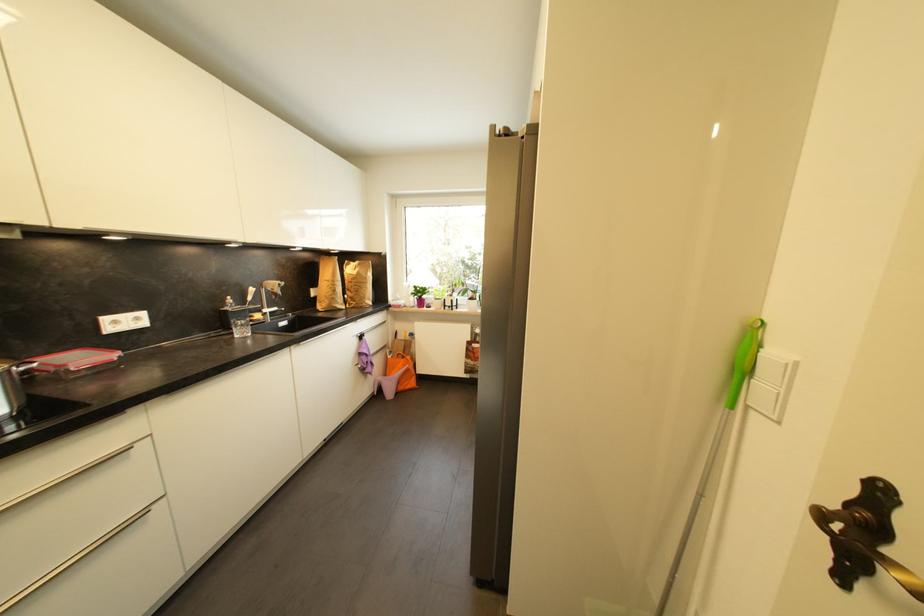
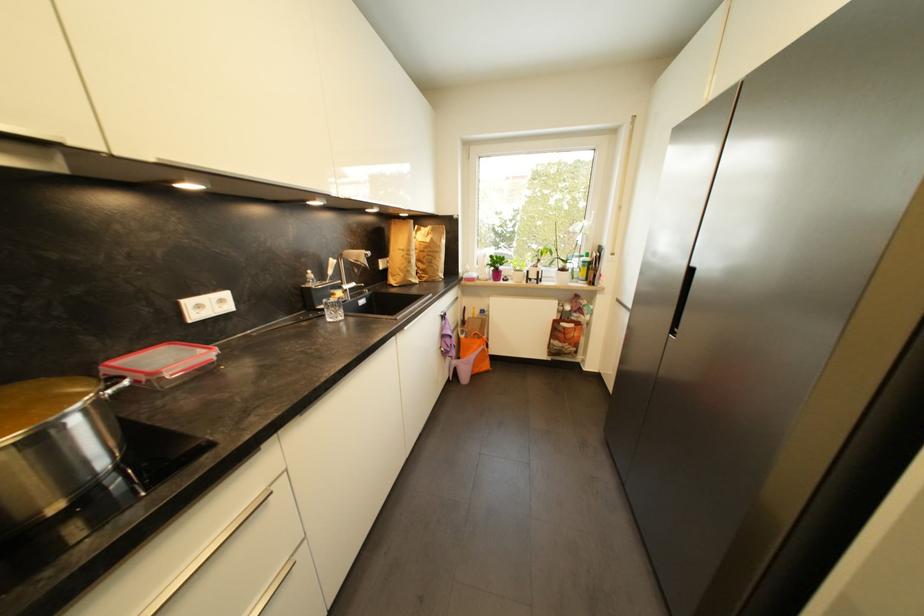
Find the pixel in the second image that matches [339,293] in the first image.

(415, 264)